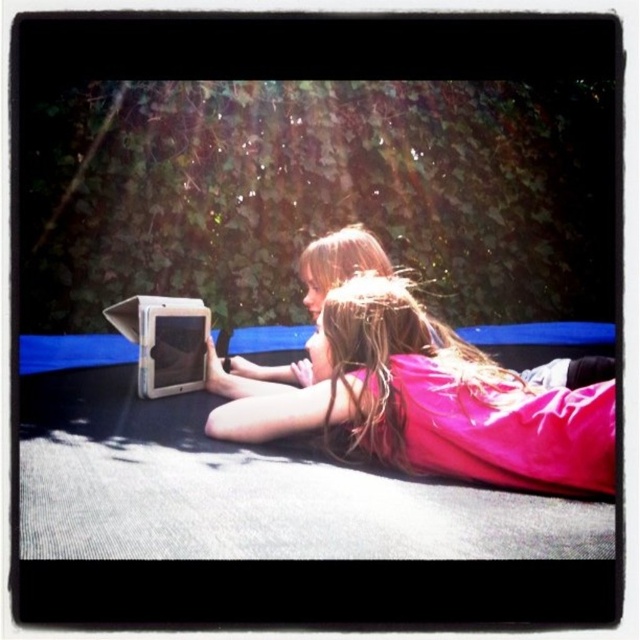
You are a photographer planning to take a photo of the scene. The pink satin dress at center and the matte white laptop at center are both in the frame. If you want to ensure both objects are fully visible without cropping, which object requires more horizontal space in the frame?

The pink satin dress at center might require more horizontal space in the frame since it is wider than the matte white laptop at center.

You are a photographer trying to capture a closeup of the tablet screen. You notice two pink items at the center of the image. Which one is wider, the pink fabric at center or the pink satin dress at center?

The pink fabric at center is wider than the pink satin dress at center according to the description.

You are a delivery person who needs to place a small package between the pink fabric at center and the pink satin dress at center. The package measures 20 centimeters in length. Can you fit the package between them without moving either object?

The distance between the pink fabric at center and the pink satin dress at center is 21.79 centimeters. Since the package is 20 centimeters long, it can fit between them as there is enough space.